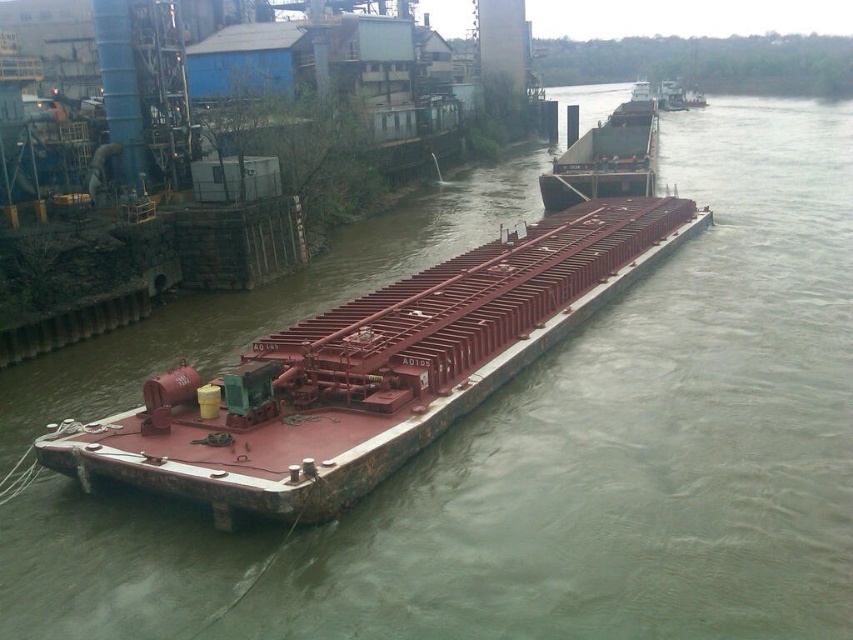
Question: Which point appears farthest from the camera in this image?

Choices:
 (A) (223, 509)
 (B) (618, 176)

Answer: (B)

Question: Can you confirm if rusty metal barge at center is positioned to the left of rustic metal barge at center?

Choices:
 (A) yes
 (B) no

Answer: (A)

Question: Where is rusty metal barge at center located in relation to rustic metal barge at center in the image?

Choices:
 (A) left
 (B) right

Answer: (A)

Question: Which of the following is the farthest from the observer?

Choices:
 (A) rustic metal barge at center
 (B) rusty metal barge at center

Answer: (A)

Question: Can you confirm if rusty metal barge at center is thinner than rustic metal barge at center?

Choices:
 (A) yes
 (B) no

Answer: (A)